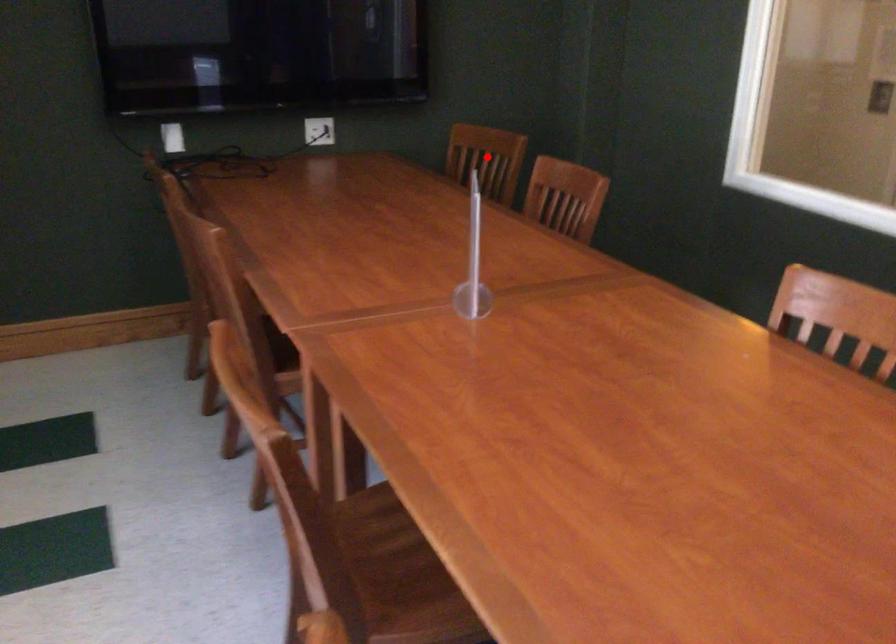
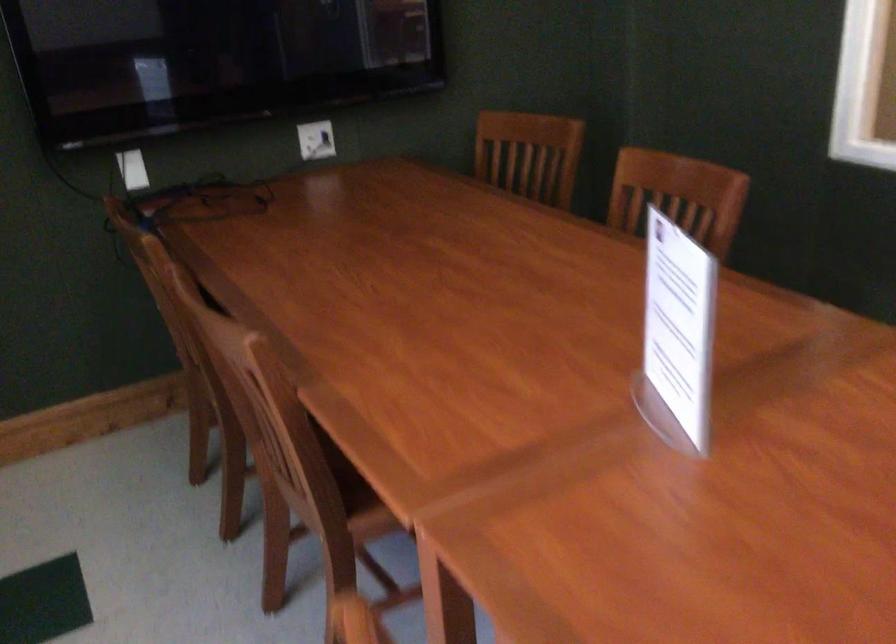
Question: I am providing you with two images of the same scene from different viewpoints. Given a red point in image1, look at the same physical point in image2. Is it:

Choices:
 (A) Closer to the viewpoint
 (B) Farther from the viewpoint

Answer: (A)